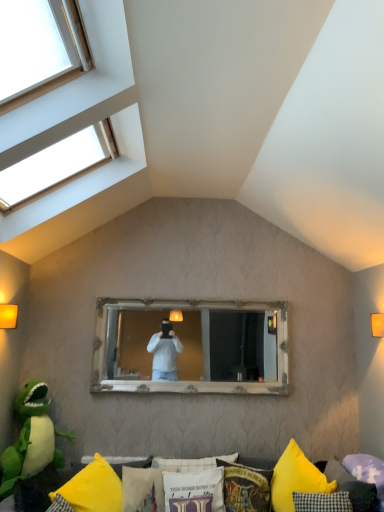
Question: Does point (269, 468) appear closer or farther from the camera than point (54, 459)?

Choices:
 (A) farther
 (B) closer

Answer: (B)

Question: Is yellow fabric cushion at lower center to the left or to the right of green plush toy at lower left in the image?

Choices:
 (A) left
 (B) right

Answer: (B)

Question: Considering the real-world distances, which object is farthest from the yellow fabric cushion at lower center?

Choices:
 (A) purple fabric pillow at lower right, which is the 5th pillow from left to right
 (B) white wooden mirror at center
 (C) white fabric pillow at lower center, arranged as the third pillow when viewed from the right
 (D) yellow fabric pillow at lower center, which is the 4th pillow from right to left
 (E) green plush toy at lower left

Answer: (A)

Question: Which object is the closest to the white wooden mirror at center?

Choices:
 (A) yellow fabric pillow at lower center, which is the 4th pillow from right to left
 (B) yellow fabric pillow at lower center, the first pillow viewed from the left
 (C) purple fabric pillow at lower right, which is the 5th pillow from left to right
 (D) green plush toy at lower left
 (E) white fabric pillow at lower center, the third pillow positioned from the left

Answer: (A)